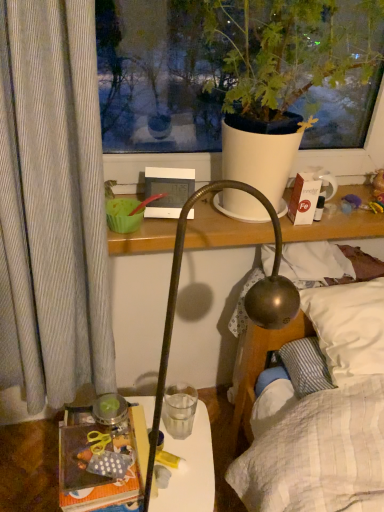
I want to click on free space above translucent plastic table at lower left (from a real-world perspective), so click(x=174, y=441).